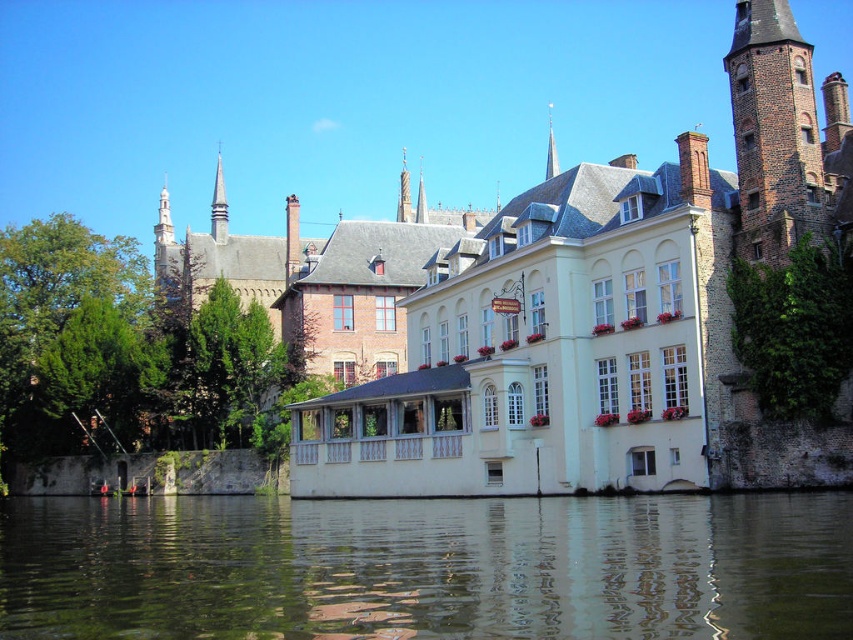
You are a tourist standing in front of the historic building along the canal. You notice two points marked in the image. Which point, point (660, 468) or point (323, 600), is closer to you?

Point (660, 468) is closer to you because it is further to the viewer than point (323, 600).

In the scene shown: You are a tour guide leading a group near the historic building. You want to point out the distance between the green reflective water at center and the brown brick tower at upper right. How far apart are they?

The green reflective water at center is 27.53 meters away from the brown brick tower at upper right.